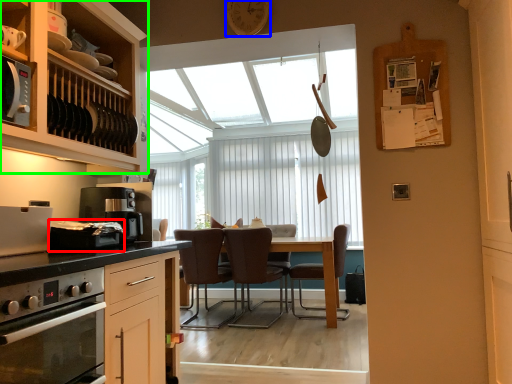
Question: Estimate the real-world distances between objects in this image. Which object is closer to appliance (highlighted by a red box), clock (highlighted by a blue box) or cabinetry (highlighted by a green box)?

Choices:
 (A) clock
 (B) cabinetry

Answer: (B)